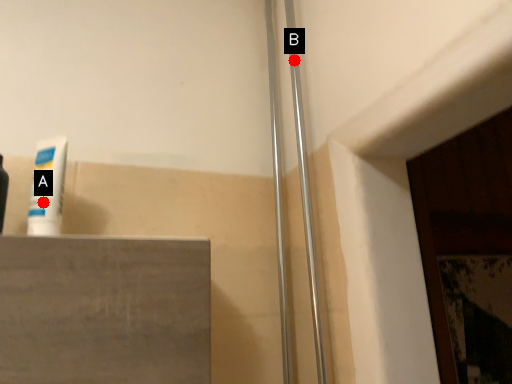
Question: Two points are circled on the image, labeled by A and B beside each circle. Which point is closer to the camera taking this photo?

Choices:
 (A) A is closer
 (B) B is closer

Answer: (A)